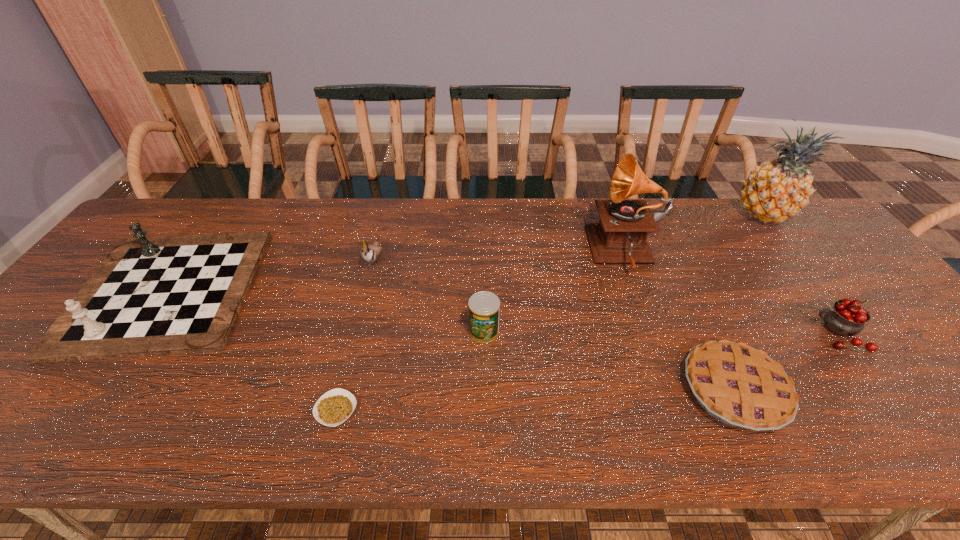
Identify the location of object that is at the far right corner. (774, 191).

In the image, there is a desktop. At what (x,y) coordinates should I click in order to perform the action: click on free space at the far edge. Please return your answer as a coordinate pair (x, y). Looking at the image, I should click on (381, 222).

Where is `free space at the near right corner of the desktop`? The height and width of the screenshot is (540, 960). free space at the near right corner of the desktop is located at coordinates (946, 443).

Locate an element on the screen. The image size is (960, 540). vacant space that is in between the phonograph record and the can is located at coordinates (555, 292).

This screenshot has width=960, height=540. In order to click on empty space between the bird and the pineapple in this screenshot , I will do `click(570, 237)`.

I want to click on free spot between the cherry and the legume, so click(x=587, y=371).

The height and width of the screenshot is (540, 960). I want to click on free spot between the pineapple and the cherry, so click(x=802, y=274).

The height and width of the screenshot is (540, 960). What are the coordinates of `vacant area between the shortest object and the leftmost object` in the screenshot? It's located at (252, 349).

Locate an element on the screen. The width and height of the screenshot is (960, 540). free area in between the phonograph record and the fifth object from right to left is located at coordinates (555, 292).

Where is `unoccupied position between the phonograph record and the fourth object from left to right`? The image size is (960, 540). unoccupied position between the phonograph record and the fourth object from left to right is located at coordinates (555, 292).